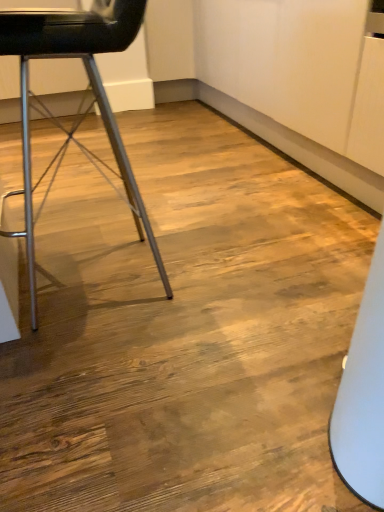
You are a GUI agent. You are given a task and a screenshot of the screen. Output one action in this format:
    pyautogui.click(x=<x>, y=<y>)
    Task: Click on the free point behind matte black chair at left
    Image resolution: width=384 pixels, height=512 pixels.
    Given the screenshot: What is the action you would take?
    pyautogui.click(x=127, y=213)